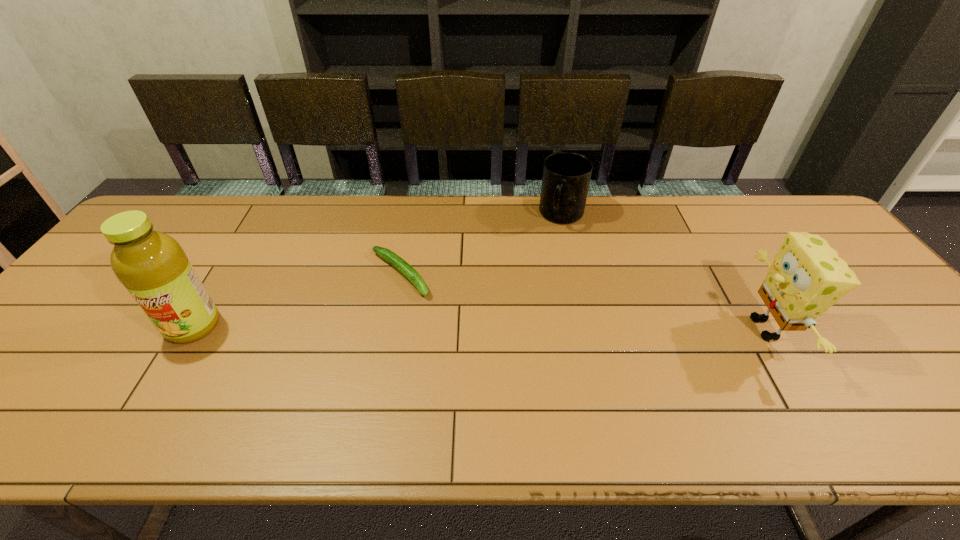
Locate an element on the screen. This screenshot has height=540, width=960. empty space between the farthest object and the fruit juice is located at coordinates (377, 271).

The width and height of the screenshot is (960, 540). Identify the location of free area in between the farthest object and the zucchini. (481, 245).

You are a GUI agent. You are given a task and a screenshot of the screen. Output one action in this format:
    pyautogui.click(x=<x>, y=<y>)
    Task: Click on the free space between the second object from right to left and the fruit juice
    This screenshot has width=960, height=540.
    Given the screenshot: What is the action you would take?
    pyautogui.click(x=377, y=271)

Image resolution: width=960 pixels, height=540 pixels. I want to click on vacant space that is in between the rightmost object and the leftmost object, so click(x=479, y=327).

The width and height of the screenshot is (960, 540). What are the coordinates of `vacant area that lies between the rightmost object and the second object from left to right` in the screenshot? It's located at (583, 301).

Choose which object is the second nearest neighbor to the farthest object. Please provide its 2D coordinates. Your answer should be formatted as a tuple, i.e. [(x, y)], where the tuple contains the x and y coordinates of a point satisfying the conditions above.

[(807, 276)]

This screenshot has width=960, height=540. Find the location of `the second closest object to the tallest object`. the second closest object to the tallest object is located at coordinates (566, 177).

The width and height of the screenshot is (960, 540). What are the coordinates of `vacant region that satisfies the following two spatial constraints: 1. on the front label of the leftmost object; 2. on the face of the sponge` in the screenshot? It's located at (192, 328).

Locate an element on the screen. vacant point that satisfies the following two spatial constraints: 1. on the front side of the second tallest object; 2. on the face of the zucchini is located at coordinates (390, 328).

Where is `vacant area in the image that satisfies the following two spatial constraints: 1. on the front side of the third shortest object; 2. on the face of the second object from right to left`? The height and width of the screenshot is (540, 960). vacant area in the image that satisfies the following two spatial constraints: 1. on the front side of the third shortest object; 2. on the face of the second object from right to left is located at coordinates (588, 328).